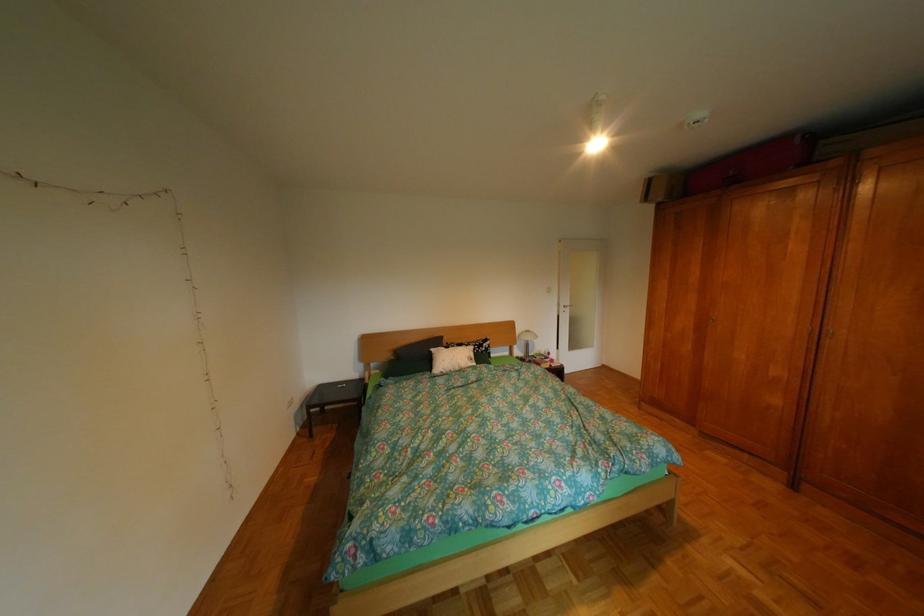
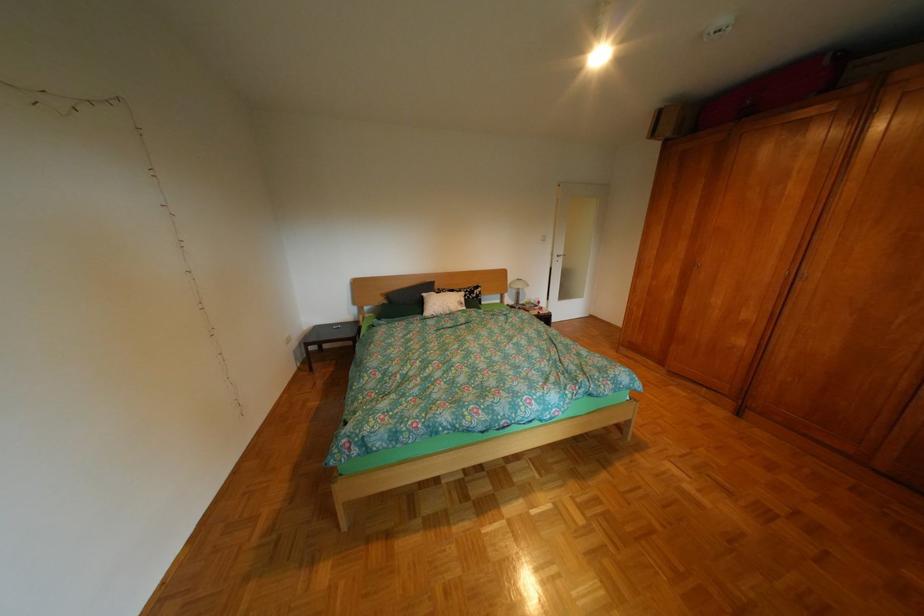
Find the pixel in the second image that matches point (447, 350) in the first image.

(439, 294)